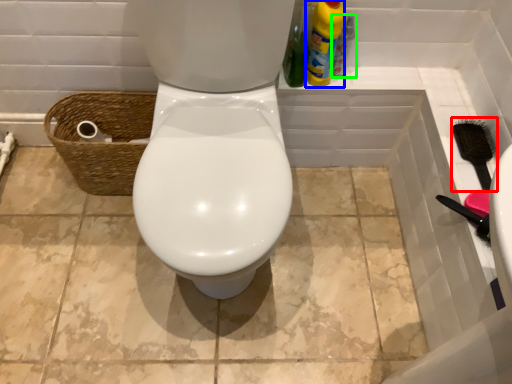
Question: Based on their relative distances, which object is farther from brush (highlighted by a red box)? Choose from cleaning product (highlighted by a blue box) and bottle (highlighted by a green box).

Choices:
 (A) cleaning product
 (B) bottle

Answer: (A)